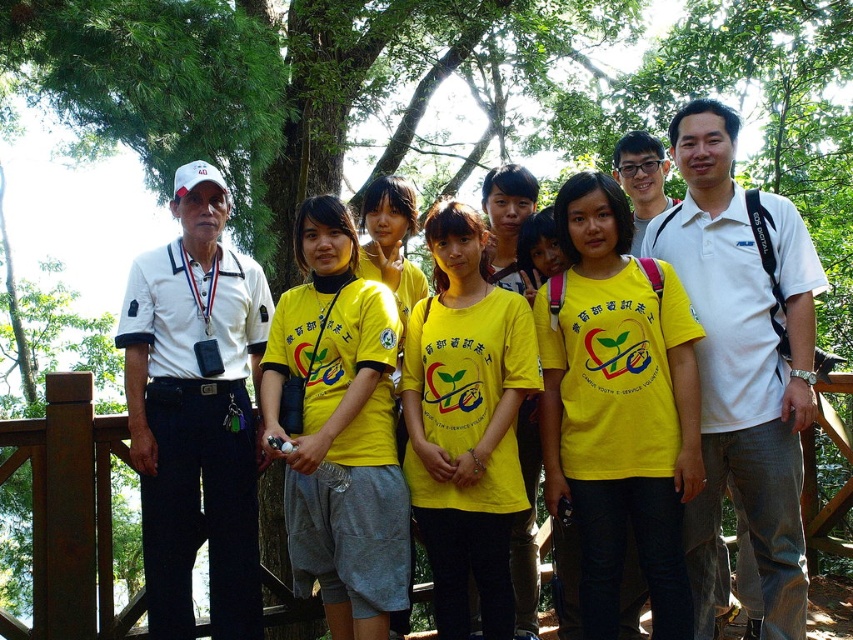
Who is higher up, white cotton polo shirt at center or yellow cotton shirt at center?

white cotton polo shirt at center is above.

Is white cotton polo shirt at center shorter than yellow cotton shirt at center?

Incorrect, white cotton polo shirt at center's height does not fall short of yellow cotton shirt at center's.

Who is more distant from viewer, (770, 456) or (363, 582)?

The point (363, 582) is more distant.

The image size is (853, 640). I want to click on white cotton polo shirt at center, so click(743, 362).

Which is behind, point (589, 632) or point (386, 412)?

Point (386, 412)

How distant is yellow matte shirt at center from yellow cotton shirt at center?

yellow matte shirt at center and yellow cotton shirt at center are 8.05 feet apart.

Identify the location of yellow matte shirt at center. The height and width of the screenshot is (640, 853). pyautogui.click(x=619, y=410).

Locate an element on the screen. yellow matte shirt at center is located at coordinates (619, 410).

Does point (612, 381) come in front of point (746, 358)?

Yes, point (612, 381) is in front of point (746, 358).

Is point (596, 436) positioned after point (785, 516)?

Yes.

Locate an element on the screen. Image resolution: width=853 pixels, height=640 pixels. yellow matte shirt at center is located at coordinates (619, 410).